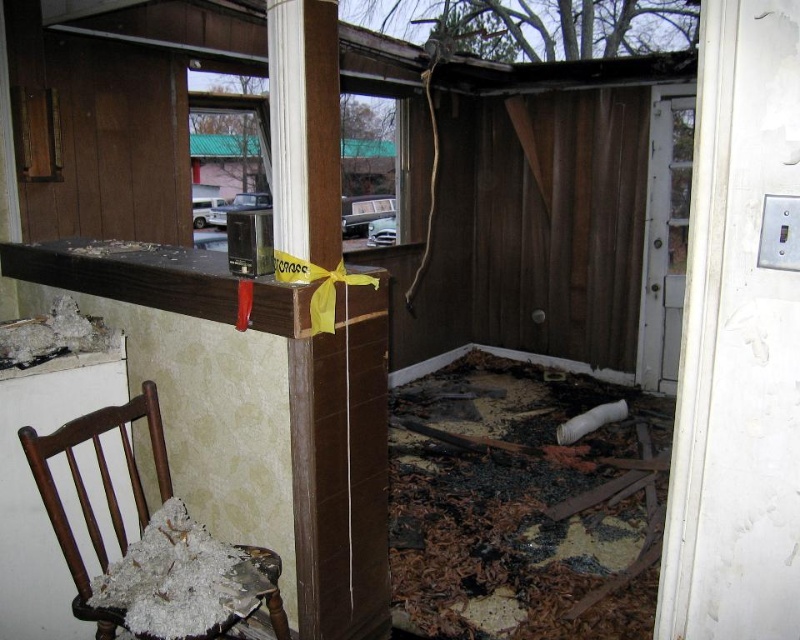
Which is more to the left, charcoal debris at lower center or wooden chair with shredded fabric at lower left?

From the viewer's perspective, wooden chair with shredded fabric at lower left appears more on the left side.

Which of these two, charcoal debris at lower center or wooden chair with shredded fabric at lower left, stands taller?

Standing taller between the two is charcoal debris at lower center.

Describe the element at coordinates (524, 506) in the screenshot. I see `charcoal debris at lower center` at that location.

Identify the location of charcoal debris at lower center. (524, 506).

Describe the element at coordinates (304, 128) in the screenshot. I see `brown wood pillar at center` at that location.

Which is more to the left, brown wood pillar at center or wooden chair with shredded fabric at lower left?

From the viewer's perspective, wooden chair with shredded fabric at lower left appears more on the left side.

The image size is (800, 640). Identify the location of brown wood pillar at center. (304, 128).

Can you confirm if charcoal debris at lower center is positioned to the left of brown wood pillar at center?

In fact, charcoal debris at lower center is to the right of brown wood pillar at center.

Is point (608, 586) closer to viewer compared to point (334, 131)?

No, it is not.

This screenshot has width=800, height=640. What are the coordinates of `charcoal debris at lower center` in the screenshot? It's located at (524, 506).